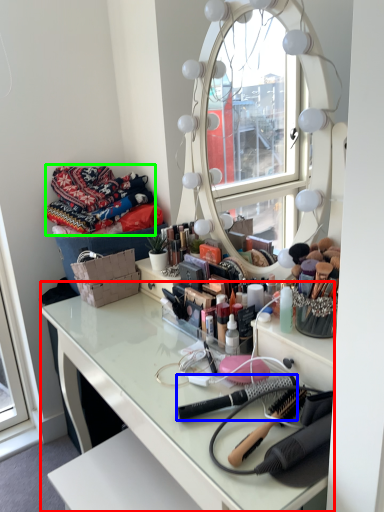
Question: Considering the real-world distances, which object is farthest from table (highlighted by a red box)? brush (highlighted by a blue box) or material (highlighted by a green box)?

Choices:
 (A) brush
 (B) material

Answer: (B)